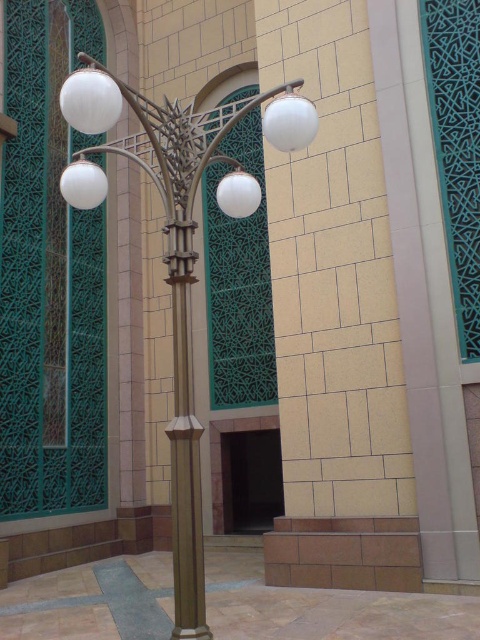
Which is below, metallic gold streetlight at center or gold metallic pole at center?

gold metallic pole at center is below.

Does metallic gold streetlight at center appear on the left side of gold metallic pole at center?

Correct, you'll find metallic gold streetlight at center to the left of gold metallic pole at center.

You are a GUI agent. You are given a task and a screenshot of the screen. Output one action in this format:
    pyautogui.click(x=<x>, y=<y>)
    Task: Click on the metallic gold streetlight at center
    The image size is (480, 640).
    Given the screenshot: What is the action you would take?
    pyautogui.click(x=178, y=252)